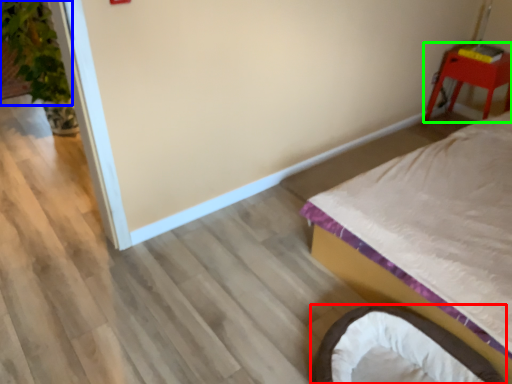
Question: Which object is the farthest from infant bed (highlighted by a red box)? Choose among these: plant (highlighted by a blue box) or furniture (highlighted by a green box).

Choices:
 (A) plant
 (B) furniture

Answer: (A)